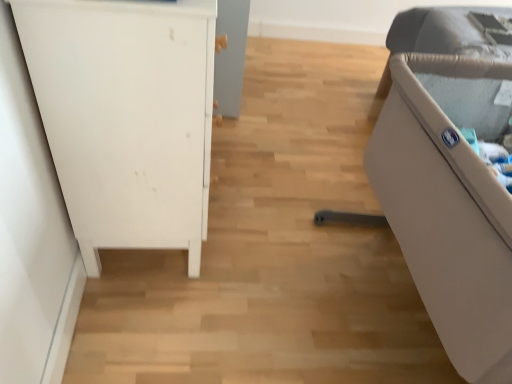
This screenshot has width=512, height=384. What are the coordinates of `empty space that is to the right of white matte cabinet at left, positioned as the 1th furniture in left-to-right order` in the screenshot? It's located at (279, 209).